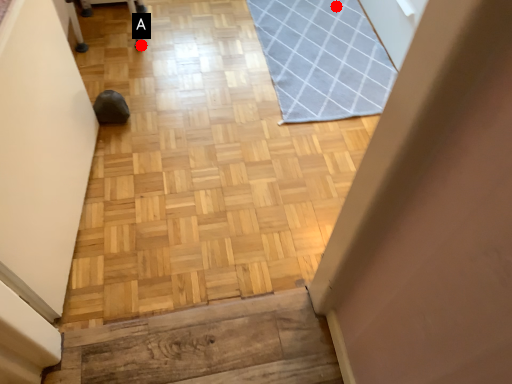
Question: Two points are circled on the image, labeled by A and B beside each circle. Which point appears farthest from the camera in this image?

Choices:
 (A) A is further
 (B) B is further

Answer: (B)